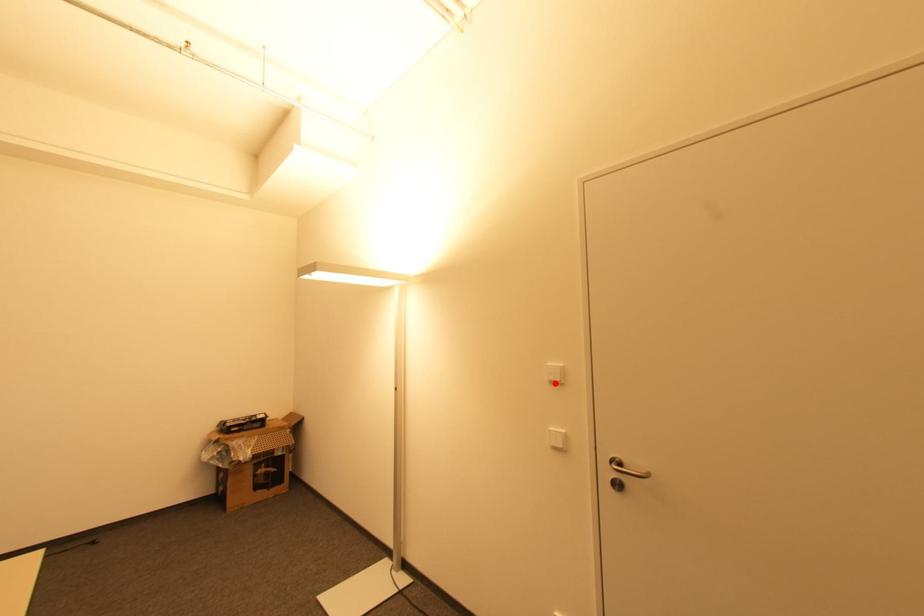
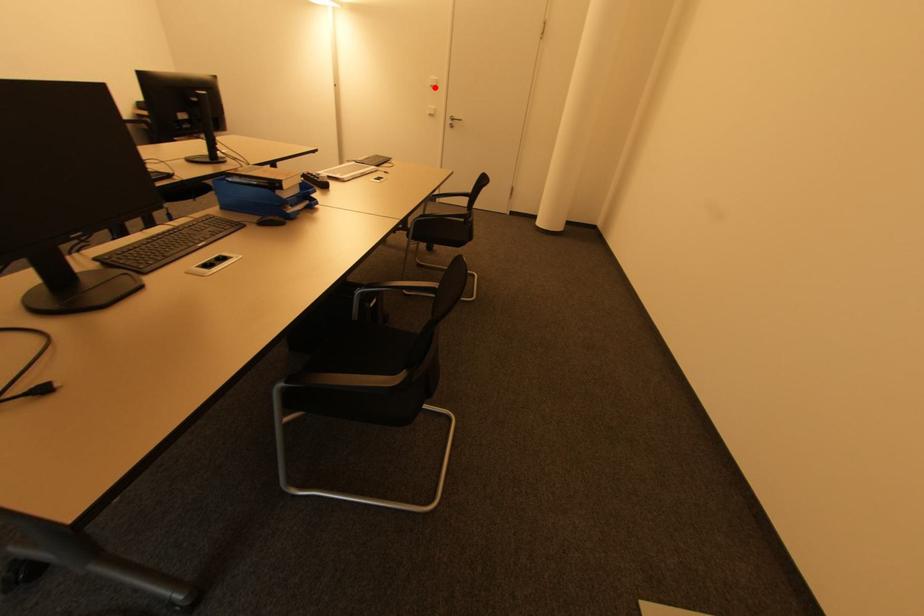
I am providing you with two images of the same scene from different viewpoints. A red point is marked on the first image and another point is marked on the second image. Do the highlighted points in image1 and image2 indicate the same real-world spot?

Yes